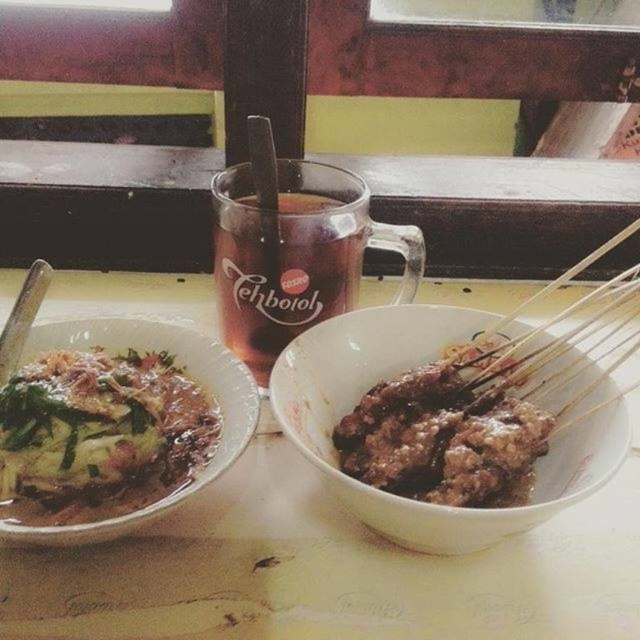
Question: Which point is closer to the camera?

Choices:
 (A) green matte vegetable at center
 (B) translucent glass mug at center

Answer: (A)

Question: Estimate the real-world distances between objects in this image. Which object is farther from the white glossy bowl at center?

Choices:
 (A) translucent glass mug at center
 (B) silver metallic chopstick at upper left

Answer: (B)

Question: Which point is farther to the camera?

Choices:
 (A) white glossy bowl at center
 (B) brown glossy skewers at center

Answer: (B)

Question: Does white glossy bowl at center appear over silver metallic chopstick at upper left?

Choices:
 (A) yes
 (B) no

Answer: (B)

Question: Does green matte vegetable at center come in front of brown glossy skewers at center?

Choices:
 (A) yes
 (B) no

Answer: (B)

Question: Does white glossy bowl at center have a larger size compared to brown glossy skewers at center?

Choices:
 (A) yes
 (B) no

Answer: (A)